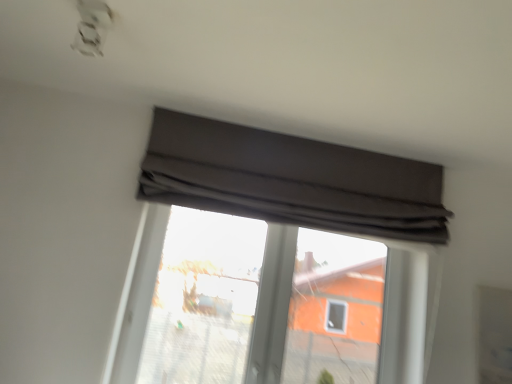
Question: Can you confirm if dark gray fabric at upper center is wider than transparent glass window at center?

Choices:
 (A) yes
 (B) no

Answer: (A)

Question: Is dark gray fabric at upper center surrounding transparent glass window at center?

Choices:
 (A) no
 (B) yes

Answer: (A)

Question: Does dark gray fabric at upper center come behind transparent glass window at center?

Choices:
 (A) no
 (B) yes

Answer: (A)

Question: Can you confirm if dark gray fabric at upper center is taller than transparent glass window at center?

Choices:
 (A) no
 (B) yes

Answer: (A)

Question: Is dark gray fabric at upper center not inside transparent glass window at center?

Choices:
 (A) no
 (B) yes

Answer: (B)

Question: Can you confirm if dark gray fabric at upper center is shorter than transparent glass window at center?

Choices:
 (A) no
 (B) yes

Answer: (B)

Question: Is transparent glass window at center directly adjacent to dark gray fabric at upper center?

Choices:
 (A) no
 (B) yes

Answer: (A)

Question: Does transparent glass window at center turn towards dark gray fabric at upper center?

Choices:
 (A) yes
 (B) no

Answer: (B)

Question: From the image's perspective, is transparent glass window at center beneath dark gray fabric at upper center?

Choices:
 (A) no
 (B) yes

Answer: (B)

Question: Can you confirm if transparent glass window at center is thinner than dark gray fabric at upper center?

Choices:
 (A) no
 (B) yes

Answer: (B)

Question: From the image's perspective, is transparent glass window at center on top of dark gray fabric at upper center?

Choices:
 (A) no
 (B) yes

Answer: (A)

Question: From a real-world perspective, is transparent glass window at center under dark gray fabric at upper center?

Choices:
 (A) no
 (B) yes

Answer: (B)

Question: From their relative heights in the image, would you say transparent glass window at center is taller or shorter than dark gray fabric at upper center?

Choices:
 (A) short
 (B) tall

Answer: (B)